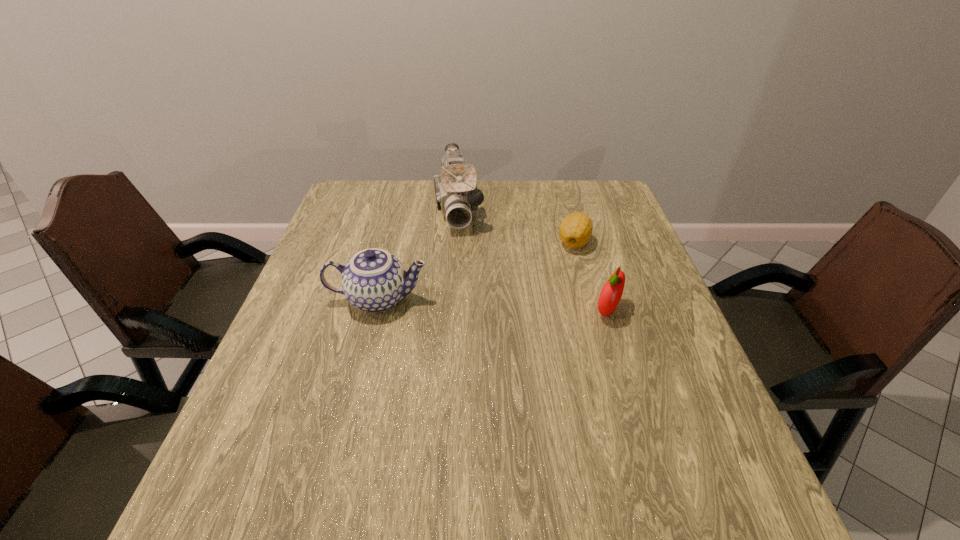
This screenshot has height=540, width=960. In the image, there is a desktop. In order to click on free space at the far left corner in this screenshot , I will do `click(353, 190)`.

Locate an element on the screen. This screenshot has height=540, width=960. vacant space at the far right corner of the desktop is located at coordinates (591, 206).

In order to click on vacant space at the near right corner in this screenshot , I will do `click(703, 435)`.

Where is `vacant area that lies between the shortest object and the chinaware`? vacant area that lies between the shortest object and the chinaware is located at coordinates (476, 271).

I want to click on free spot between the chinaware and the shortest object, so click(x=476, y=271).

You are a GUI agent. You are given a task and a screenshot of the screen. Output one action in this format:
    pyautogui.click(x=<x>, y=<y>)
    Task: Click on the free space between the apple and the chinaware
    Image resolution: width=960 pixels, height=540 pixels.
    Given the screenshot: What is the action you would take?
    pyautogui.click(x=492, y=305)

The image size is (960, 540). Identify the location of unoccupied position between the shortest object and the third shortest object. (476, 271).

Locate an element on the screen. vacant point located between the lemon and the tallest object is located at coordinates (516, 225).

Image resolution: width=960 pixels, height=540 pixels. In order to click on blank region between the third shortest object and the third tallest object in this screenshot , I will do `click(492, 305)`.

The image size is (960, 540). What are the coordinates of `free spot between the chinaware and the lemon` in the screenshot? It's located at (476, 271).